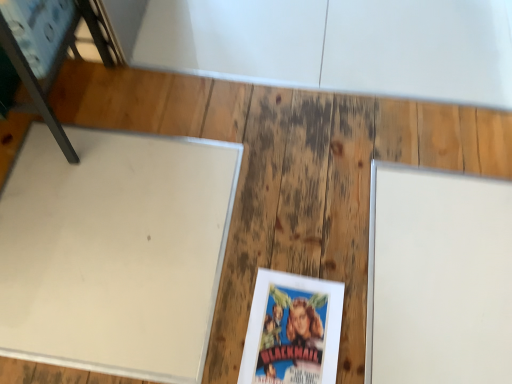
You are a GUI agent. You are given a task and a screenshot of the screen. Output one action in this format:
    pyautogui.click(x=<x>, y=<y>)
    Task: Click on the free space to the back side of white matte board at left
    The height and width of the screenshot is (384, 512).
    Given the screenshot: What is the action you would take?
    pyautogui.click(x=157, y=102)